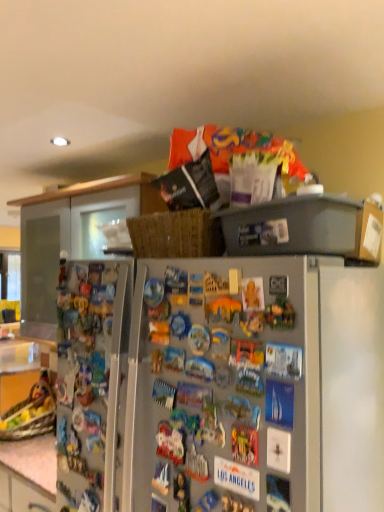
What do you see at coordinates (255, 386) in the screenshot? I see `satin silver refrigerator at center` at bounding box center [255, 386].

The image size is (384, 512). What are the coordinates of `satin silver refrigerator at center` in the screenshot? It's located at (255, 386).

What is the approximate height of satin silver refrigerator at center?

satin silver refrigerator at center is 6.33 feet in height.

In order to face satin silver refrigerator at center, should I rotate leftwards or rightwards?

Turn left by 4.435 degrees to look at satin silver refrigerator at center.

Describe the element at coordinates (71, 237) in the screenshot. I see `matte wood cabinet at upper center` at that location.

This screenshot has height=512, width=384. I want to click on matte wood cabinet at upper center, so click(71, 237).

Identify the location of satin silver refrigerator at center. (255, 386).

Between matte wood cabinet at upper center and satin silver refrigerator at center, which one appears on the right side from the viewer's perspective?

satin silver refrigerator at center is more to the right.

Is matte wood cabinet at upper center behind satin silver refrigerator at center?

That is True.

Considering the points (50, 209) and (276, 499), which point is in front, point (50, 209) or point (276, 499)?

Positioned in front is point (276, 499).

From the image's perspective, which is below, matte wood cabinet at upper center or satin silver refrigerator at center?

From the image's view, satin silver refrigerator at center is below.

From a real-world perspective, is matte wood cabinet at upper center positioned above or below satin silver refrigerator at center?

Clearly, from a real-world perspective, matte wood cabinet at upper center is above satin silver refrigerator at center.

In terms of width, does matte wood cabinet at upper center look wider or thinner when compared to satin silver refrigerator at center?

matte wood cabinet at upper center is wider than satin silver refrigerator at center.

Does matte wood cabinet at upper center have a greater height compared to satin silver refrigerator at center?

Incorrect, the height of matte wood cabinet at upper center is not larger of that of satin silver refrigerator at center.

Is matte wood cabinet at upper center bigger or smaller than satin silver refrigerator at center?

Clearly, matte wood cabinet at upper center is smaller in size than satin silver refrigerator at center.

Is matte wood cabinet at upper center inside or outside of satin silver refrigerator at center?

matte wood cabinet at upper center is outside satin silver refrigerator at center.

Is matte wood cabinet at upper center beside satin silver refrigerator at center?

No.

Looking at this image, is matte wood cabinet at upper center aimed at satin silver refrigerator at center?

No, matte wood cabinet at upper center is not oriented towards satin silver refrigerator at center.

Can you tell me how much matte wood cabinet at upper center and satin silver refrigerator at center differ in facing direction?

2.6 degrees separate the facing orientations of matte wood cabinet at upper center and satin silver refrigerator at center.

I want to click on refrigerator below the matte wood cabinet at upper center (from a real-world perspective), so click(x=255, y=386).

Does satin silver refrigerator at center appear on the right side of matte wood cabinet at upper center?

Yes.

Which object is closer to the camera taking this photo, satin silver refrigerator at center or matte wood cabinet at upper center?

satin silver refrigerator at center is closer to the camera.

Which is closer to the camera, (245,490) or (93,214)?

Positioned in front is point (245,490).

From the image's perspective, is satin silver refrigerator at center on matte wood cabinet at upper center?

No, from the image's perspective, satin silver refrigerator at center is not over matte wood cabinet at upper center.

From a real-world perspective, between satin silver refrigerator at center and matte wood cabinet at upper center, who is vertically higher?

In real-world perspective, matte wood cabinet at upper center is above.

Consider the image. In terms of width, does satin silver refrigerator at center look wider or thinner when compared to matte wood cabinet at upper center?

In the image, satin silver refrigerator at center appears to be more narrow than matte wood cabinet at upper center.

Consider the image. Does satin silver refrigerator at center have a lesser height compared to matte wood cabinet at upper center?

Incorrect, the height of satin silver refrigerator at center does not fall short of that of matte wood cabinet at upper center.

Based on the photo, does satin silver refrigerator at center have a smaller size compared to matte wood cabinet at upper center?

No, satin silver refrigerator at center is not smaller than matte wood cabinet at upper center.

Is satin silver refrigerator at center inside the boundaries of matte wood cabinet at upper center, or outside?

satin silver refrigerator at center exists outside the volume of matte wood cabinet at upper center.

Is satin silver refrigerator at center in contact with matte wood cabinet at upper center?

satin silver refrigerator at center is not next to matte wood cabinet at upper center, and they're not touching.

Is satin silver refrigerator at center oriented towards matte wood cabinet at upper center?

Yes, satin silver refrigerator at center is facing matte wood cabinet at upper center.

Identify the location of cabinetry behind the satin silver refrigerator at center. Image resolution: width=384 pixels, height=512 pixels. (71, 237).

The height and width of the screenshot is (512, 384). Find the location of `refrigerator on the right of matte wood cabinet at upper center`. refrigerator on the right of matte wood cabinet at upper center is located at coordinates (255, 386).

The image size is (384, 512). I want to click on refrigerator lying below the matte wood cabinet at upper center (from the image's perspective), so click(x=255, y=386).